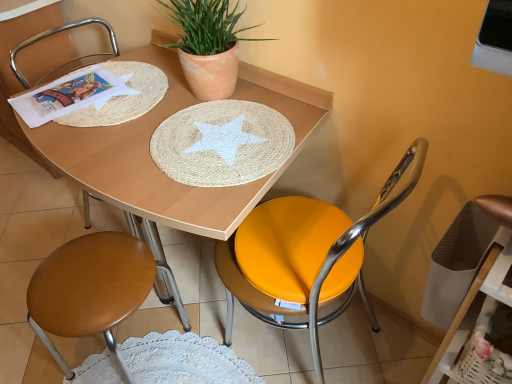
Question: Does metallic yellow seat at center, which ranks as the third chair in left-to-right order, have a lesser height compared to brown leather stool at lower left, arranged as the first chair when viewed from the left?

Choices:
 (A) yes
 (B) no

Answer: (B)

Question: Does metallic yellow seat at center, positioned as the 1th chair in right-to-left order, have a larger size compared to brown leather stool at lower left, arranged as the first chair when viewed from the left?

Choices:
 (A) no
 (B) yes

Answer: (B)

Question: Is metallic yellow seat at center, positioned as the 1th chair in right-to-left order, not within brown leather stool at lower left, which is counted as the 3th chair, starting from the right?

Choices:
 (A) yes
 (B) no

Answer: (A)

Question: Can you confirm if metallic yellow seat at center, which ranks as the third chair in left-to-right order, is wider than brown leather stool at lower left, arranged as the first chair when viewed from the left?

Choices:
 (A) yes
 (B) no

Answer: (A)

Question: Is metallic yellow seat at center, which ranks as the third chair in left-to-right order, taller than brown leather stool at lower left, which is counted as the 3th chair, starting from the right?

Choices:
 (A) no
 (B) yes

Answer: (B)

Question: Which is correct: matte terracotta pot at upper center is inside metallic yellow seat at center, positioned as the 1th chair in right-to-left order, or outside of it?

Choices:
 (A) outside
 (B) inside

Answer: (A)

Question: In the image, is matte terracotta pot at upper center on the left side or the right side of metallic yellow seat at center, positioned as the 1th chair in right-to-left order?

Choices:
 (A) right
 (B) left

Answer: (B)

Question: Considering the positions of point (195, 89) and point (241, 223), is point (195, 89) closer or farther from the camera than point (241, 223)?

Choices:
 (A) closer
 (B) farther

Answer: (B)

Question: From the image's perspective, is matte terracotta pot at upper center above or below metallic yellow seat at center, which ranks as the third chair in left-to-right order?

Choices:
 (A) below
 (B) above

Answer: (B)

Question: From the image's perspective, is metallic yellow seat at center, which ranks as the third chair in left-to-right order, positioned above or below metallic gold swivel chair at right?

Choices:
 (A) above
 (B) below

Answer: (A)

Question: Is point (318, 276) closer or farther from the camera than point (462, 289)?

Choices:
 (A) closer
 (B) farther

Answer: (B)

Question: Would you say metallic yellow seat at center, positioned as the 1th chair in right-to-left order, is inside or outside metallic gold swivel chair at right?

Choices:
 (A) inside
 (B) outside

Answer: (B)

Question: From their relative heights in the image, would you say metallic yellow seat at center, which ranks as the third chair in left-to-right order, is taller or shorter than metallic gold swivel chair at right?

Choices:
 (A) short
 (B) tall

Answer: (B)

Question: Looking at the image, does matte wood table at center seem bigger or smaller compared to metallic gold swivel chair at right?

Choices:
 (A) small
 (B) big

Answer: (B)

Question: Looking at their shapes, would you say matte wood table at center is wider or thinner than metallic gold swivel chair at right?

Choices:
 (A) wide
 (B) thin

Answer: (A)